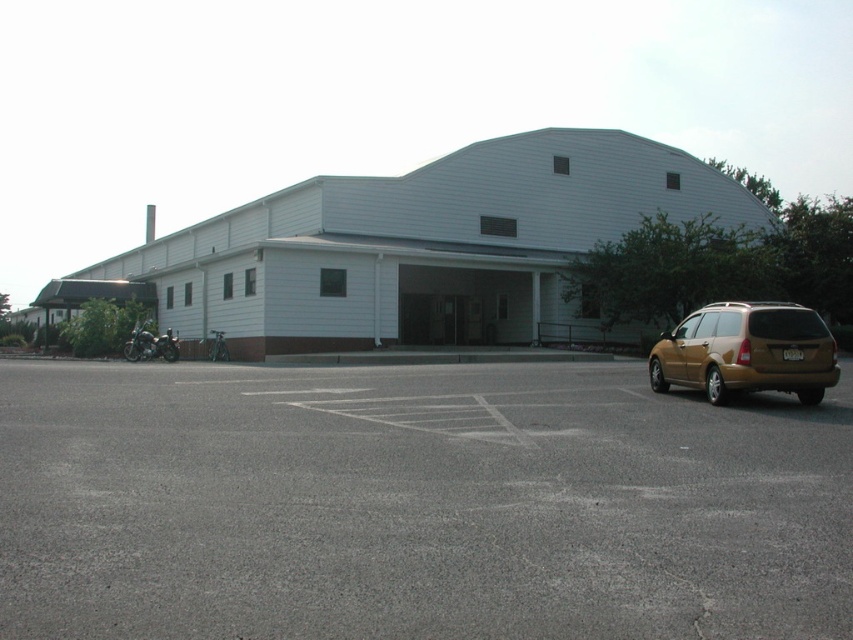
Question: Does gray asphalt parking lot at center have a smaller size compared to gold metallic suv at right?

Choices:
 (A) no
 (B) yes

Answer: (B)

Question: Which point is farther to the camera?

Choices:
 (A) gray asphalt parking lot at center
 (B) gold metallic suv at right

Answer: (B)

Question: Is gray asphalt parking lot at center closer to the viewer compared to gold metallic suv at right?

Choices:
 (A) yes
 (B) no

Answer: (A)

Question: Is gray asphalt parking lot at center to the right of gold metallic suv at right from the viewer's perspective?

Choices:
 (A) yes
 (B) no

Answer: (B)

Question: Which of the following is the closest to the observer?

Choices:
 (A) gold metallic suv at right
 (B) gray asphalt parking lot at center

Answer: (B)